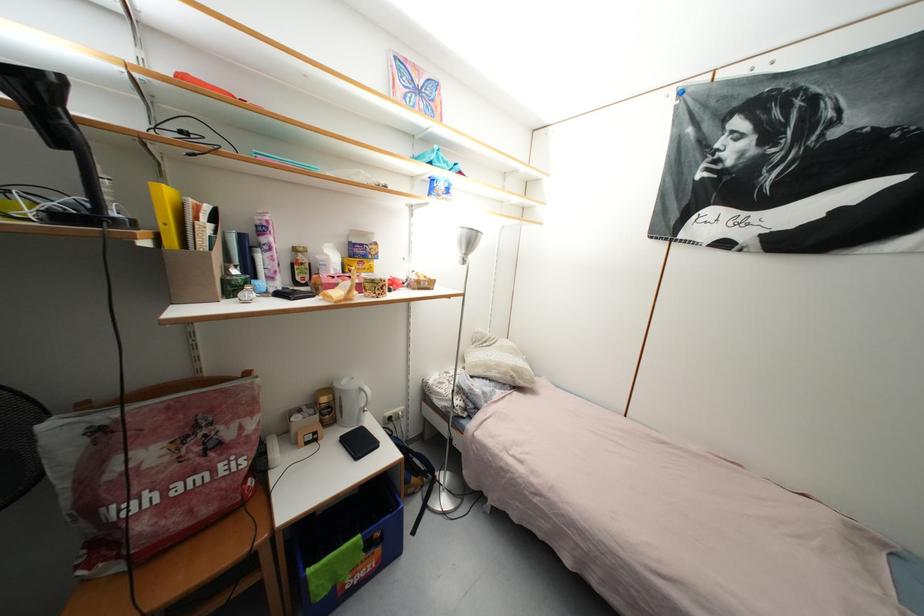
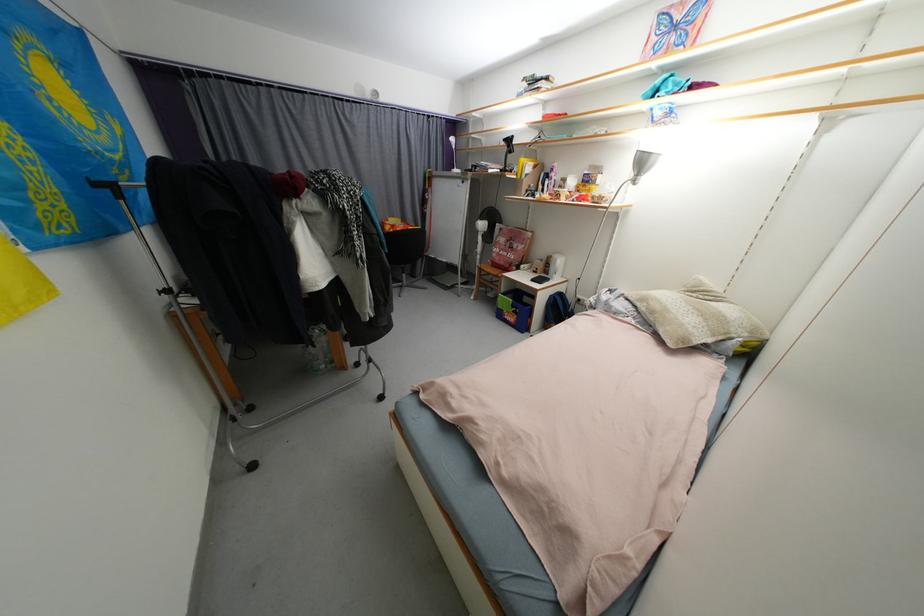
Where in the second image is the point corresponding to point (511, 376) from the first image?

(658, 314)